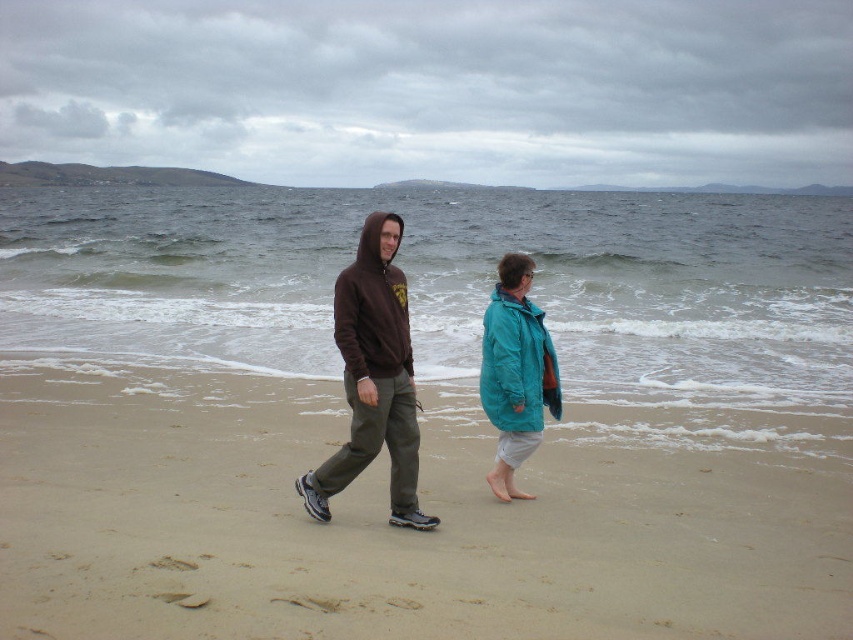
Question: Among these points, which one is nearest to the camera?

Choices:
 (A) (352, 396)
 (B) (480, 387)

Answer: (A)

Question: Does sandy at center appear on the left side of teal fabric jacket at center?

Choices:
 (A) yes
 (B) no

Answer: (A)

Question: Which point is closer to the camera?

Choices:
 (A) 172,573
 (B) 610,276

Answer: (A)

Question: Can you confirm if sandy at center is bigger than matte brown hoodie at center?

Choices:
 (A) yes
 (B) no

Answer: (B)

Question: Which point is farther from the camera taking this photo?

Choices:
 (A) (497, 419)
 (B) (469, 332)
 (C) (410, 435)
 (D) (701, 504)

Answer: (B)

Question: Is sandy at center to the right of brown hoodie at center from the viewer's perspective?

Choices:
 (A) no
 (B) yes

Answer: (B)